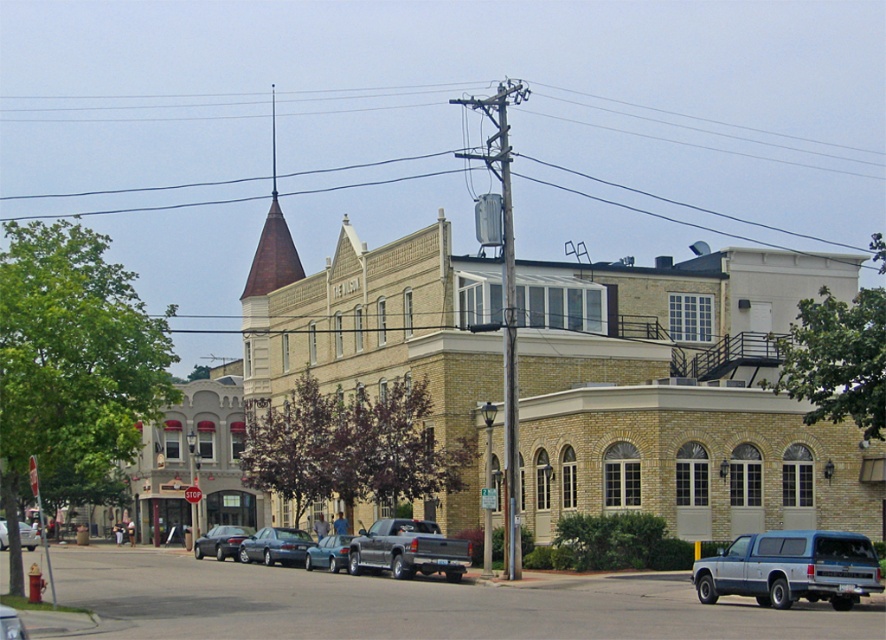
You are standing in front of the building and want to take a photo that includes both point (x=689, y=433) and point (x=507, y=534). Which point should you focus on first to ensure both are in focus?

You should focus on point (x=507, y=534) first because it is closer to you than point (x=689, y=433), which is further away. By focusing on the closer point, the further point will still be within the depth of field.